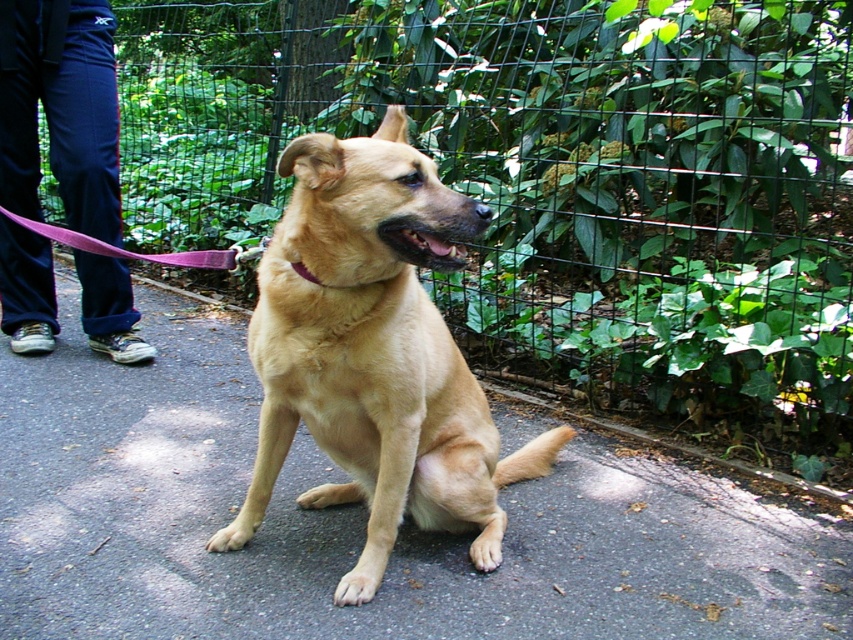
You are a photographer trying to capture the dog in the scene. You want to ensure the pink fabric leash at center is visible in your shot. Based on its 2D coordinates, where should you position the camera to include the leash in the frame?

The pink fabric leash at center is located at point (142, 253) in the 2D space. Position the camera so that the leash falls within the frame by ensuring the camera angle includes this coordinate.

You are standing on the smooth asphalt pavement at center and want to reach a bench located 2 meters away from you. Can you walk to the bench without stepping off the pavement?

The smooth asphalt pavement at center and viewer are 1.79 meters apart. Since the bench is 2 meters away, you can walk to the bench without stepping off the pavement as the distance is within the available space.

What is the type of surface at the point with coordinates (358,520) in the image?

The surface at point (358,520) is smooth asphalt pavement.